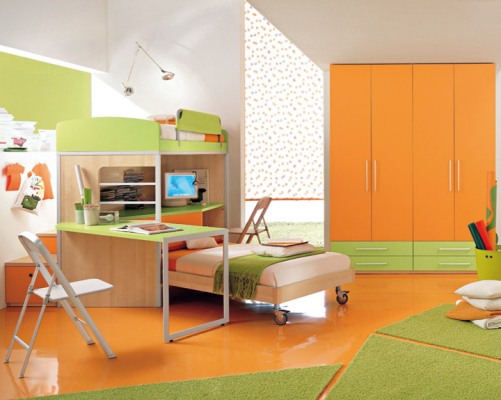
Where is `orange lockers`? orange lockers is located at coordinates (340, 110), (396, 133), (426, 129), (481, 128).